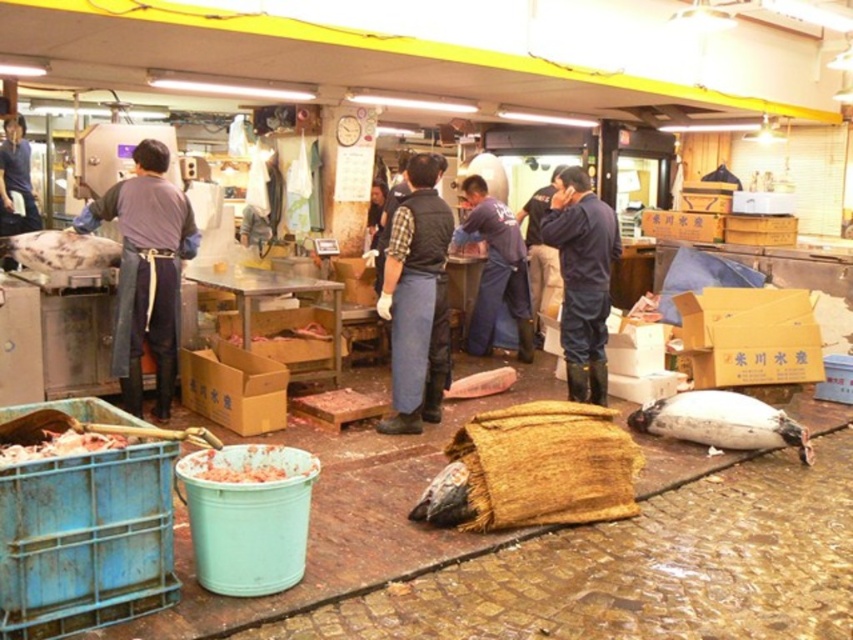
You are a customer at the fish market and want to buy both the meat paste at lower left and the dark blue fabric at center. Which of these items is smaller in size?

The meat paste at lower left has a smaller size compared to the dark blue fabric at center, so the meat paste at lower left is smaller.

You are a worker in the fish market and need to step over an object. You have to choose between the dark blue rubber boots at center and the dark blue fabric at center. Which one is easier to step over?

Result: The dark blue rubber boots at center has a smaller size compared to dark blue fabric at center, so the dark blue fabric at center is larger and thus easier to step over.